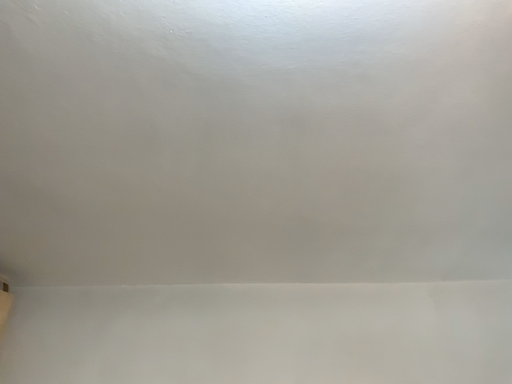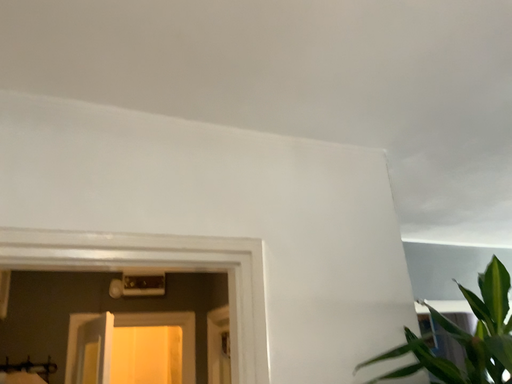
Question: Which way did the camera rotate in the video?

Choices:
 (A) rotated downward
 (B) rotated upward

Answer: (A)